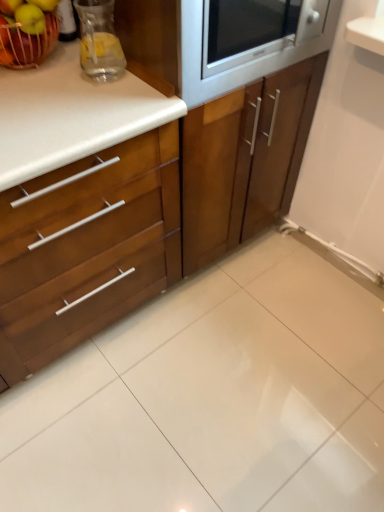
The height and width of the screenshot is (512, 384). I want to click on free space to the left of clear glass pitcher at upper left, so click(50, 82).